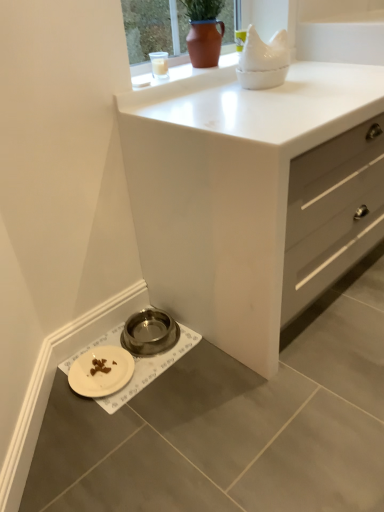
At what (x,y) coordinates should I click in order to perform the action: click on blank space above white matte chest of drawers at center (from a real-world perspective). Please return your answer as a coordinate pair (x, y). Looking at the image, I should click on [278, 88].